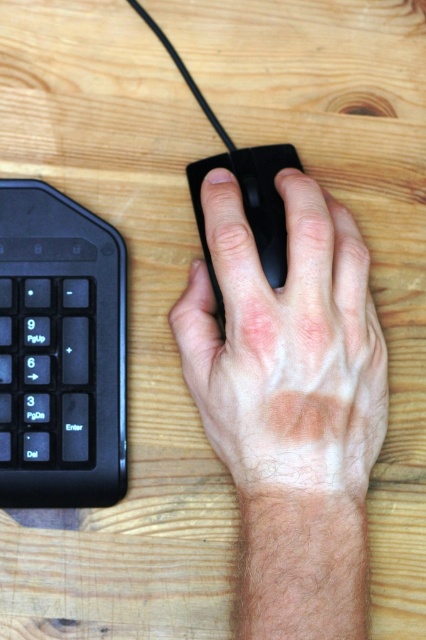
Does black matte keyboard at lower left have a lesser height compared to black matte mouse at center?

Incorrect, black matte keyboard at lower left's height does not fall short of black matte mouse at center's.

Does black matte keyboard at lower left appear on the right side of black matte mouse at center?

No, black matte keyboard at lower left is not to the right of black matte mouse at center.

Between point (3, 353) and point (267, 237), which one is positioned behind?

Positioned behind is point (3, 353).

This screenshot has height=640, width=426. I want to click on black matte keyboard at lower left, so (x=60, y=352).

Can you confirm if smooth matte black mouse at center is positioned above black matte mouse at center?

Actually, smooth matte black mouse at center is below black matte mouse at center.

Can you confirm if smooth matte black mouse at center is thinner than black matte mouse at center?

Incorrect, smooth matte black mouse at center's width is not less than black matte mouse at center's.

Is point (221, 362) more distant than point (284, 269)?

No, it is not.

Locate an element on the screen. smooth matte black mouse at center is located at coordinates (287, 348).

Who is taller, smooth matte black mouse at center or black matte keyboard at lower left?

With more height is black matte keyboard at lower left.

Is smooth matte black mouse at center shorter than black matte keyboard at lower left?

Yes, smooth matte black mouse at center is shorter than black matte keyboard at lower left.

Identify the location of smooth matte black mouse at center. The width and height of the screenshot is (426, 640). (287, 348).

This screenshot has height=640, width=426. What are the coordinates of `smooth matte black mouse at center` in the screenshot? It's located at (287, 348).